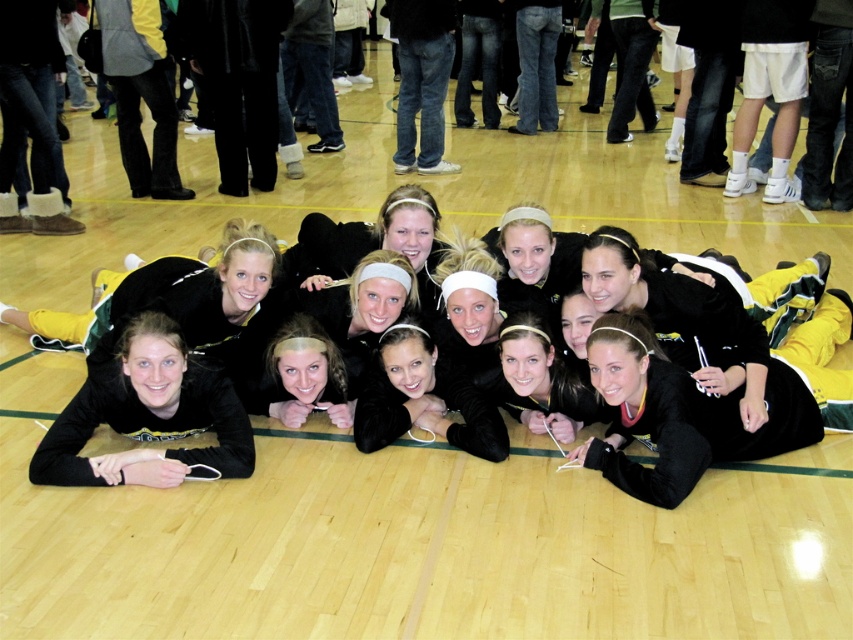
Is black matte headband at center shorter than matte black headband at center?

No, black matte headband at center is not shorter than matte black headband at center.

Which is below, black matte headband at center or matte black headband at center?

black matte headband at center is lower down.

The height and width of the screenshot is (640, 853). Identify the location of black matte headband at center. (148, 413).